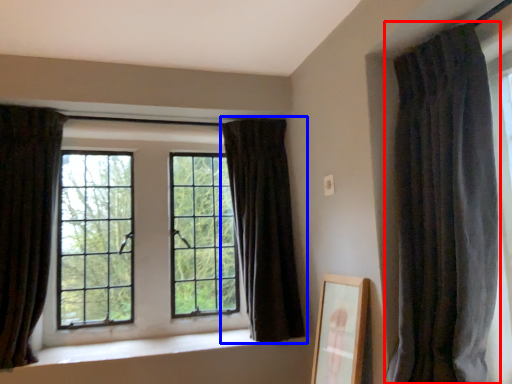
Question: Which of the following is the farthest to the observer, curtain (highlighted by a red box) or curtain (highlighted by a blue box)?

Choices:
 (A) curtain
 (B) curtain

Answer: (B)